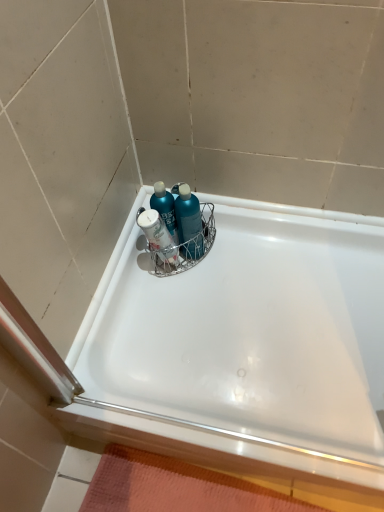
Question: Is orange textured bath mat at bottom taller than white glossy ledge at lower right?

Choices:
 (A) no
 (B) yes

Answer: (A)

Question: Is orange textured bath mat at bottom thinner than white glossy ledge at lower right?

Choices:
 (A) no
 (B) yes

Answer: (A)

Question: Does orange textured bath mat at bottom come behind white glossy ledge at lower right?

Choices:
 (A) yes
 (B) no

Answer: (A)

Question: Is orange textured bath mat at bottom not inside white glossy ledge at lower right?

Choices:
 (A) yes
 (B) no

Answer: (A)

Question: Is orange textured bath mat at bottom shorter than white glossy ledge at lower right?

Choices:
 (A) yes
 (B) no

Answer: (A)

Question: Can you confirm if orange textured bath mat at bottom is positioned to the right of white glossy ledge at lower right?

Choices:
 (A) yes
 (B) no

Answer: (A)

Question: Is white glossy bathtub at upper center smaller than white glossy ledge at lower right?

Choices:
 (A) no
 (B) yes

Answer: (A)

Question: Considering the relative sizes of white glossy bathtub at upper center and white glossy ledge at lower right in the image provided, is white glossy bathtub at upper center wider than white glossy ledge at lower right?

Choices:
 (A) yes
 (B) no

Answer: (A)

Question: From a real-world perspective, is white glossy bathtub at upper center below white glossy ledge at lower right?

Choices:
 (A) no
 (B) yes

Answer: (A)

Question: Considering the relative sizes of white glossy bathtub at upper center and white glossy ledge at lower right in the image provided, is white glossy bathtub at upper center shorter than white glossy ledge at lower right?

Choices:
 (A) no
 (B) yes

Answer: (B)

Question: Is white glossy bathtub at upper center further to camera compared to white glossy ledge at lower right?

Choices:
 (A) yes
 (B) no

Answer: (A)

Question: Does white glossy bathtub at upper center have a lesser width compared to white glossy ledge at lower right?

Choices:
 (A) yes
 (B) no

Answer: (B)

Question: Could you tell me if orange textured bath mat at bottom is facing teal glossy bottle at center?

Choices:
 (A) yes
 (B) no

Answer: (B)